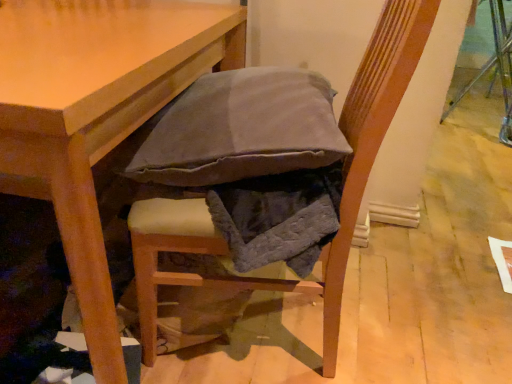
The image size is (512, 384). What do you see at coordinates (96, 114) in the screenshot? I see `light brown wooden table at center` at bounding box center [96, 114].

Where is `light brown wooden table at center`? The image size is (512, 384). light brown wooden table at center is located at coordinates (96, 114).

The width and height of the screenshot is (512, 384). Describe the element at coordinates (343, 189) in the screenshot. I see `textured fabric cushion at center` at that location.

This screenshot has height=384, width=512. In order to click on textured fabric cushion at center in this screenshot , I will do `click(343, 189)`.

Find the location of `light brown wooden table at center`. light brown wooden table at center is located at coordinates (96, 114).

Based on their positions, is light brown wooden table at center located to the left or right of textured fabric cushion at center?

light brown wooden table at center is to the left of textured fabric cushion at center.

Is the depth of light brown wooden table at center greater than that of textured fabric cushion at center?

No, it is not.

Between point (111, 119) and point (405, 18), which one is positioned in front?

The point (111, 119) is closer.

From the image's perspective, does light brown wooden table at center appear higher than textured fabric cushion at center?

Yes, from the image's perspective, light brown wooden table at center is above textured fabric cushion at center.

From a real-world perspective, which object rests below the other?

From a 3D spatial view, light brown wooden table at center is below.

Is light brown wooden table at center thinner than textured fabric cushion at center?

Result: Incorrect, the width of light brown wooden table at center is not less than that of textured fabric cushion at center.

Based on the photo, in terms of height, does light brown wooden table at center look taller or shorter compared to textured fabric cushion at center?

light brown wooden table at center is shorter than textured fabric cushion at center.

Considering the relative sizes of light brown wooden table at center and textured fabric cushion at center in the image provided, is light brown wooden table at center bigger than textured fabric cushion at center?

Yes, light brown wooden table at center is bigger than textured fabric cushion at center.

Is light brown wooden table at center inside the boundaries of textured fabric cushion at center, or outside?

light brown wooden table at center is spatially situated outside textured fabric cushion at center.

Is light brown wooden table at center placed right next to textured fabric cushion at center?

light brown wooden table at center and textured fabric cushion at center are not in contact.

Is light brown wooden table at center looking in the opposite direction of textured fabric cushion at center?

That's not correct — light brown wooden table at center is not looking away from textured fabric cushion at center.

How different are the orientations of light brown wooden table at center and textured fabric cushion at center in degrees?

They differ by 85.5 degrees in their facing directions.

Find the location of a particular element. The image size is (512, 384). chair below the light brown wooden table at center (from the image's perspective) is located at coordinates (343, 189).

Considering the positions of objects textured fabric cushion at center and light brown wooden table at center in the image provided, who is more to the left, textured fabric cushion at center or light brown wooden table at center?

From the viewer's perspective, light brown wooden table at center appears more on the left side.

Considering the relative positions of textured fabric cushion at center and light brown wooden table at center in the image provided, is textured fabric cushion at center in front of light brown wooden table at center?

No, textured fabric cushion at center is further to the viewer.

Is point (371, 118) positioned before point (84, 211)?

No, (371, 118) is behind (84, 211).

From the image's perspective, is textured fabric cushion at center on light brown wooden table at center?

Actually, textured fabric cushion at center appears below light brown wooden table at center in the image.

From a real-world perspective, relative to light brown wooden table at center, is textured fabric cushion at center vertically above or below?

Clearly, from a real-world perspective, textured fabric cushion at center is above light brown wooden table at center.

Considering the sizes of objects textured fabric cushion at center and light brown wooden table at center in the image provided, who is thinner, textured fabric cushion at center or light brown wooden table at center?

textured fabric cushion at center is thinner.

Does textured fabric cushion at center have a greater height compared to light brown wooden table at center?

Yes, textured fabric cushion at center is taller than light brown wooden table at center.

Between textured fabric cushion at center and light brown wooden table at center, which one has larger size?

With larger size is light brown wooden table at center.

Is textured fabric cushion at center positioned beyond the bounds of light brown wooden table at center?

Yes, textured fabric cushion at center is located beyond the bounds of light brown wooden table at center.

Is there a large distance between textured fabric cushion at center and light brown wooden table at center?

They are positioned close to each other.

Is textured fabric cushion at center facing towards light brown wooden table at center?

Yes, textured fabric cushion at center is oriented towards light brown wooden table at center.

How different are the orientations of textured fabric cushion at center and light brown wooden table at center in degrees?

85.5 degrees separate the facing orientations of textured fabric cushion at center and light brown wooden table at center.

Identify the location of chair lying behind the light brown wooden table at center. (343, 189).

Identify the location of table below the textured fabric cushion at center (from a real-world perspective). The width and height of the screenshot is (512, 384). (96, 114).

Where is `table to the left of textured fabric cushion at center`? table to the left of textured fabric cushion at center is located at coordinates (96, 114).